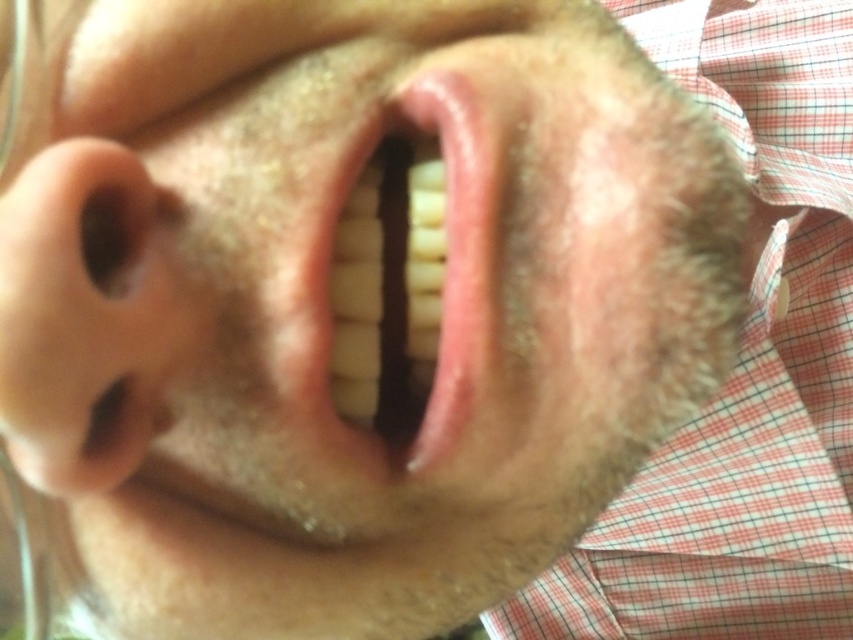
Which is more to the right, red checkered fabric at right or glossy pink lips at center?

From the viewer's perspective, red checkered fabric at right appears more on the right side.

Does point (665, 609) lie in front of point (459, 390)?

No, it is behind (459, 390).

Is point (724, 513) farther from camera compared to point (445, 152)?

Yes, point (724, 513) is farther from viewer.

Where is `red checkered fabric at right`? The image size is (853, 640). red checkered fabric at right is located at coordinates (743, 365).

Who is positioned more to the left, pink flesh-colored nose at left or glossy pink lips at center?

From the viewer's perspective, pink flesh-colored nose at left appears more on the left side.

Identify the location of pink flesh-colored nose at left. The image size is (853, 640). (85, 316).

Does point (171, 308) lie in front of point (462, 227)?

Yes.

Identify the location of pink flesh-colored nose at left. This screenshot has width=853, height=640. (85, 316).

Does red checkered fabric at right come in front of pink flesh-colored nose at left?

No, it is behind pink flesh-colored nose at left.

Is point (695, 97) positioned in front of point (167, 321)?

No, it is not.

The height and width of the screenshot is (640, 853). Find the location of `red checkered fabric at right`. red checkered fabric at right is located at coordinates (743, 365).

I want to click on red checkered fabric at right, so click(743, 365).